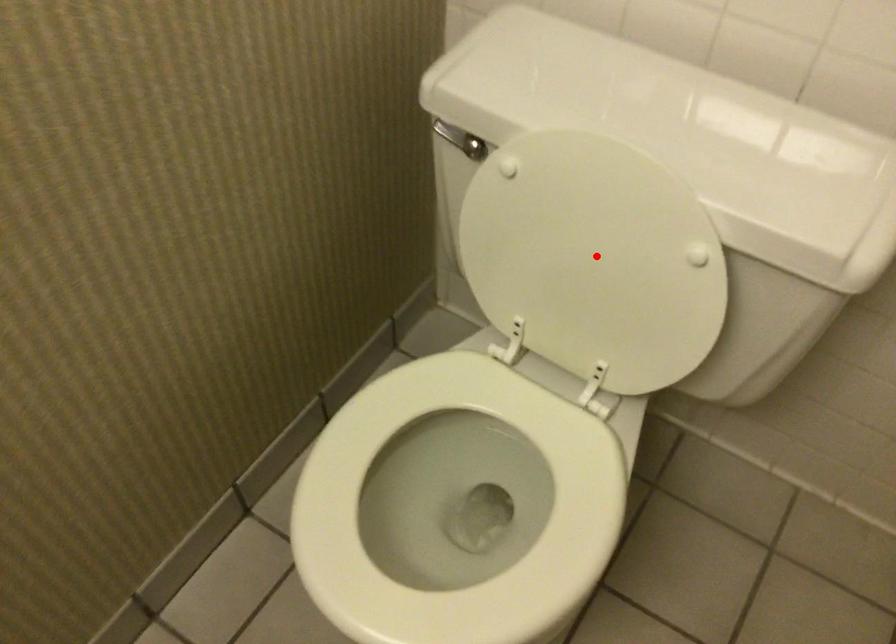
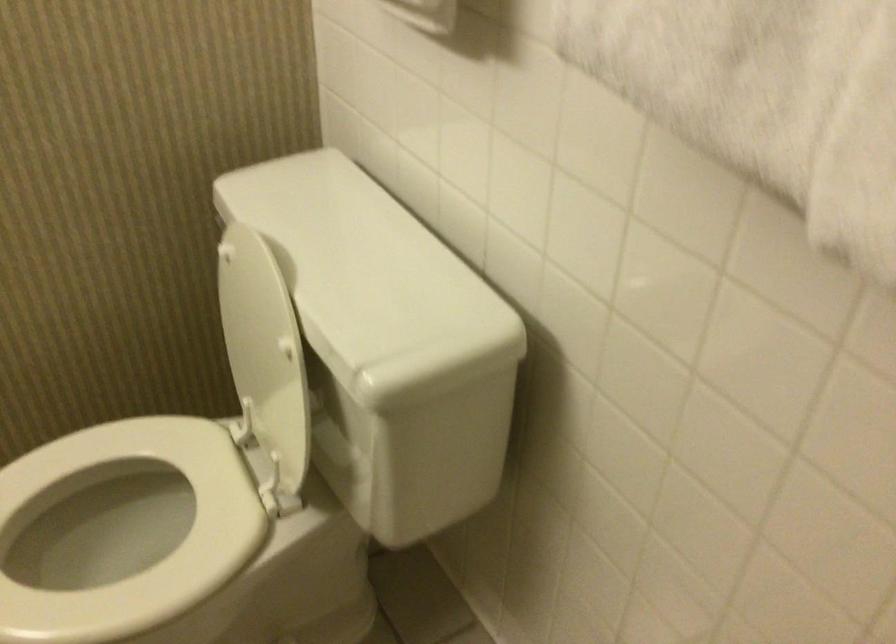
Question: I am providing you with two images of the same scene from different viewpoints. In image1, a red point is highlighted. Considering the same 3D point in image2, which of the following is correct?

Choices:
 (A) It is closer
 (B) It is farther

Answer: (B)